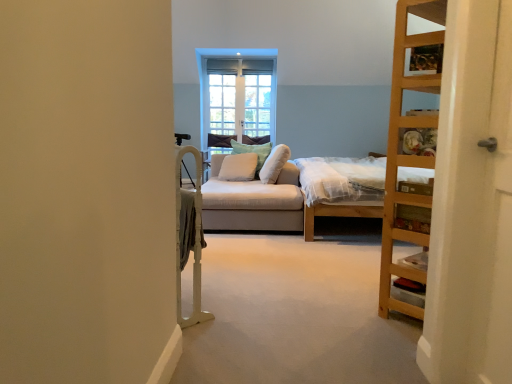
You are a GUI agent. You are given a task and a screenshot of the screen. Output one action in this format:
    pyautogui.click(x=<x>, y=<y>)
    Task: Click on the vacant space situated on the left part of wooden ladder at right
    
    Given the screenshot: What is the action you would take?
    pyautogui.click(x=351, y=315)